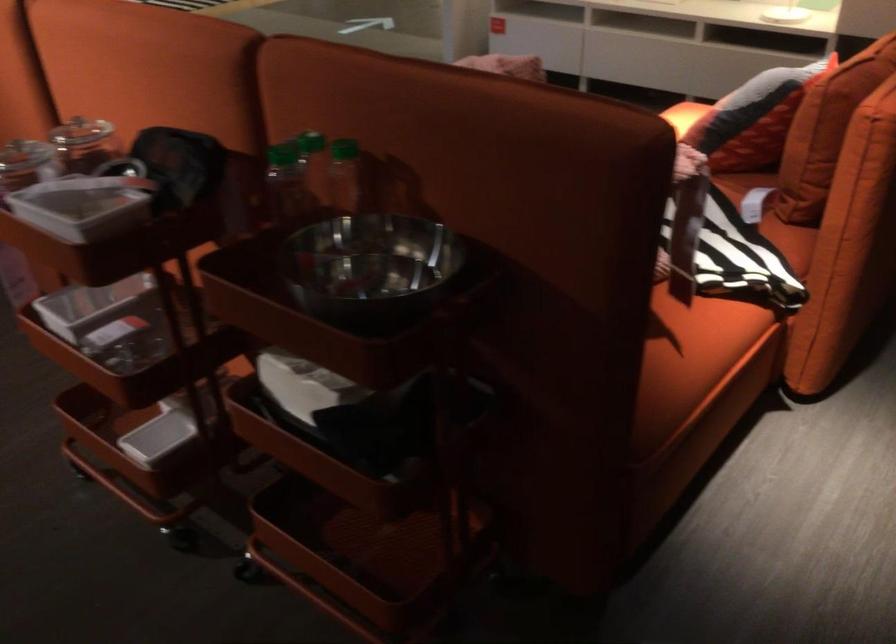
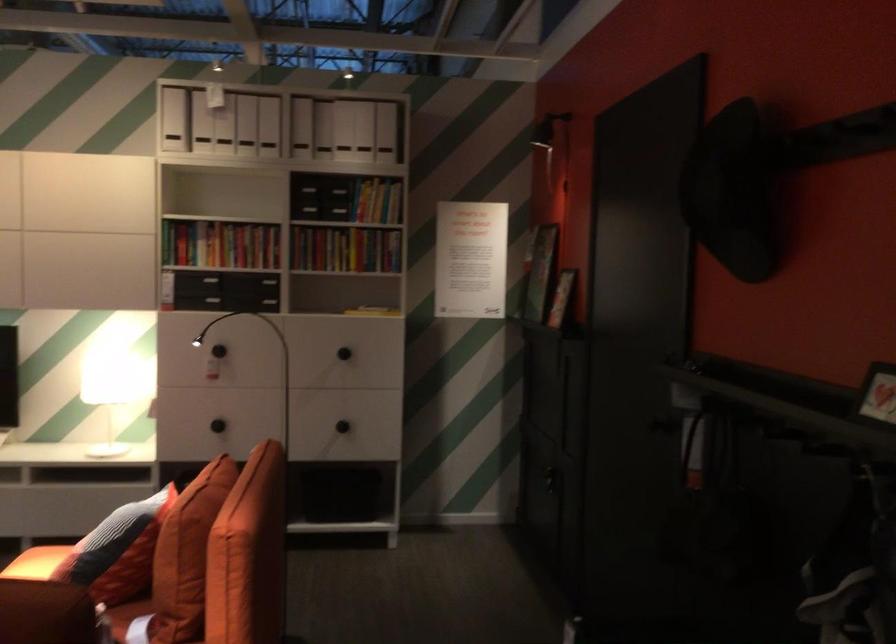
In the second image, find the point that corresponds to (824,120) in the first image.

(186, 554)